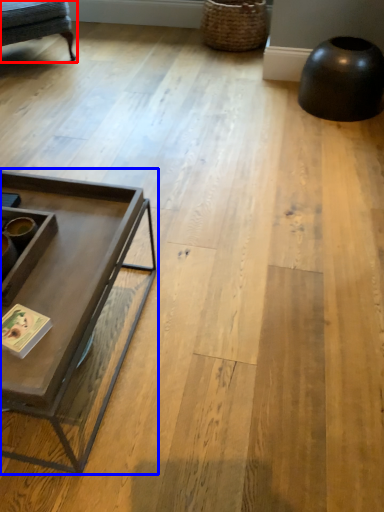
Question: Which object is further to the camera taking this photo, swivel chair (highlighted by a red box) or coffee table (highlighted by a blue box)?

Choices:
 (A) swivel chair
 (B) coffee table

Answer: (A)